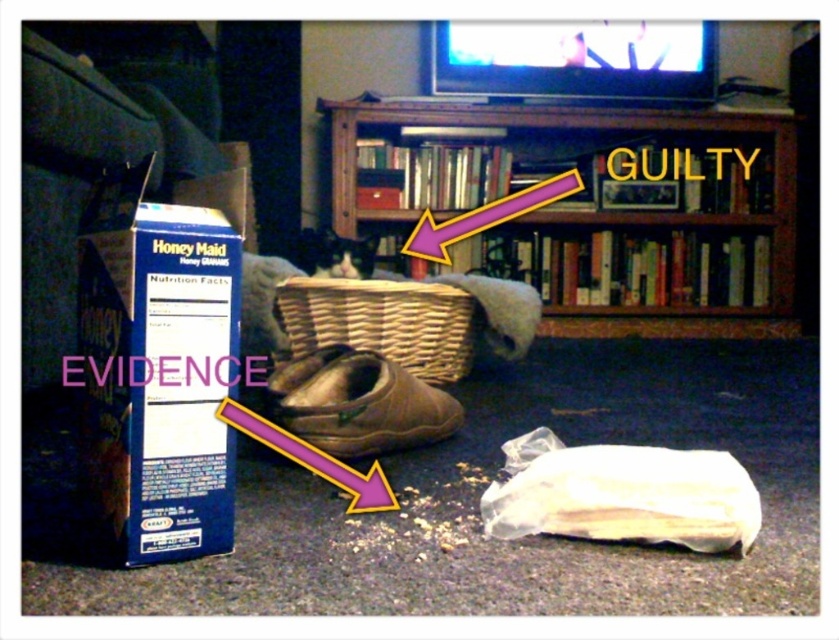
Is point (688, 330) farther from viewer compared to point (413, 328)?

Yes, point (688, 330) is behind point (413, 328).

Does point (420, 168) lie in front of point (382, 294)?

That is False.

Who is more distant from viewer, [395,168] or [308,324]?

Point [395,168]

Locate an element on the screen. wooden bookcase at upper center is located at coordinates (590, 205).